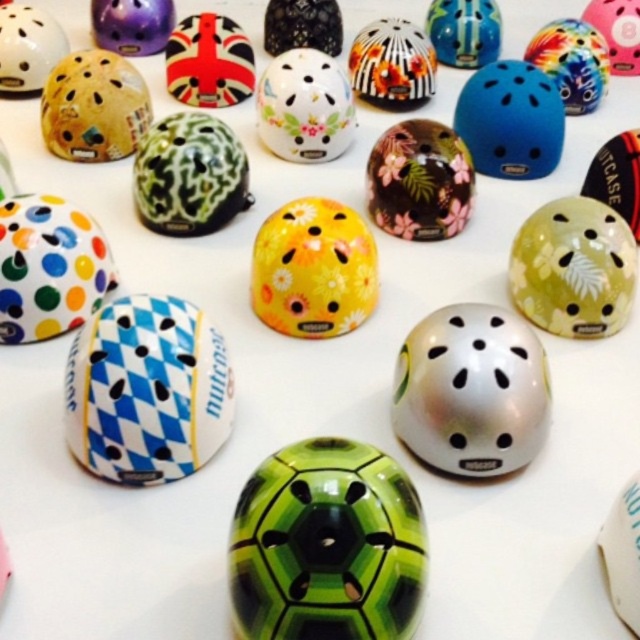
You are organizing a childrens helmet display. You have two helmets in the center area, the green glossy helmet at center and the union jack helmet at center. Which one is narrower?

The green glossy helmet at center has a lesser width compared to the union jack helmet at center, so it is narrower.